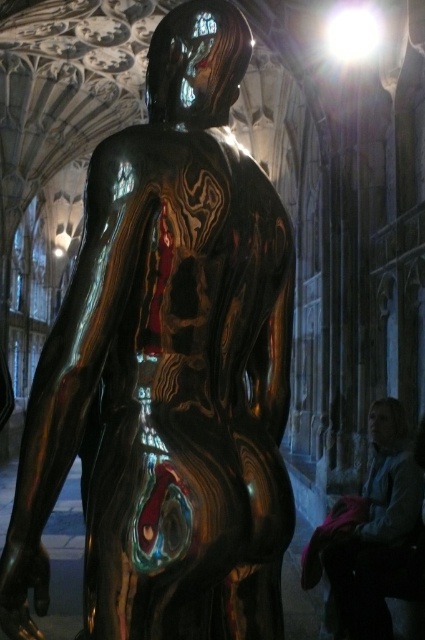
Question: From the image, what is the correct spatial relationship of glossy bronze statue at center in relation to blue fabric jacket at lower right?

Choices:
 (A) right
 (B) left

Answer: (B)

Question: Which of the following is the farthest from the observer?

Choices:
 (A) glossy bronze statue at center
 (B) blue fabric jacket at lower right

Answer: (B)

Question: Can you confirm if glossy bronze statue at center is positioned to the left of blue fabric jacket at lower right?

Choices:
 (A) no
 (B) yes

Answer: (B)

Question: Which of the following is the farthest from the observer?

Choices:
 (A) (102, 630)
 (B) (374, 442)

Answer: (B)

Question: Is glossy bronze statue at center thinner than blue fabric jacket at lower right?

Choices:
 (A) yes
 (B) no

Answer: (B)